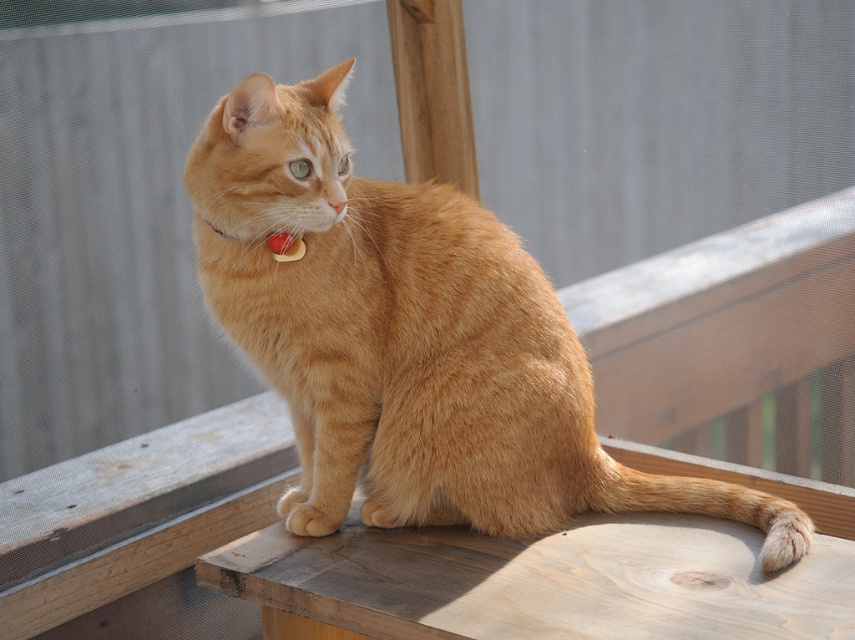
Question: Is the position of orange fur cat at center less distant than that of red plastic collar at center?

Choices:
 (A) no
 (B) yes

Answer: (B)

Question: Which of the following is the farthest from the observer?

Choices:
 (A) (278, 244)
 (B) (209, 141)

Answer: (A)

Question: Which of the following is the closest to the observer?

Choices:
 (A) (268, 246)
 (B) (205, 218)

Answer: (B)

Question: Does orange fur cat at center appear on the left side of red plastic collar at center?

Choices:
 (A) no
 (B) yes

Answer: (A)

Question: Does orange fur cat at center appear on the right side of red plastic collar at center?

Choices:
 (A) no
 (B) yes

Answer: (B)